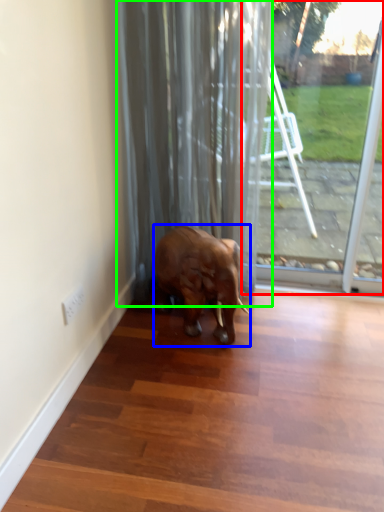
Question: Estimate the real-world distances between objects in this image. Which object is closer to glass door (highlighted by a red box), elephant (highlighted by a blue box) or curtain (highlighted by a green box)?

Choices:
 (A) elephant
 (B) curtain

Answer: (B)